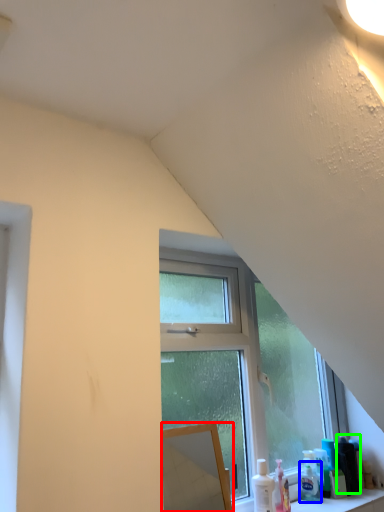
Question: Considering the real-world distances, which object is closest to mirror (highlighted by a red box)? toiletry (highlighted by a blue box) or toiletry (highlighted by a green box).

Choices:
 (A) toiletry
 (B) toiletry

Answer: (A)